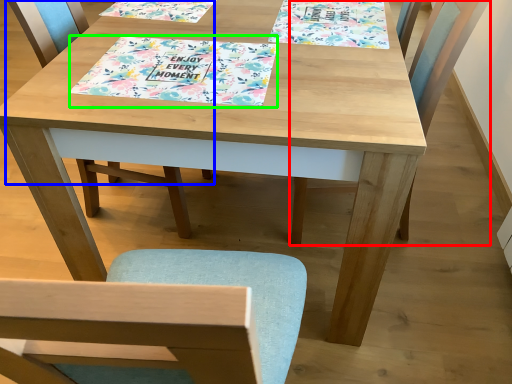
Question: Which object is the farthest from chair (highlighted by a red box)? Choose among these: chair (highlighted by a blue box) or tablecloth (highlighted by a green box).

Choices:
 (A) chair
 (B) tablecloth

Answer: (A)